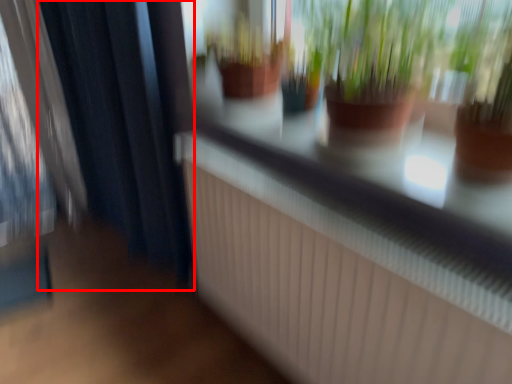
Question: From the image, what is the correct spatial relationship of curtain (annotated by the red box) in relation to shop window?

Choices:
 (A) right
 (B) left

Answer: (B)